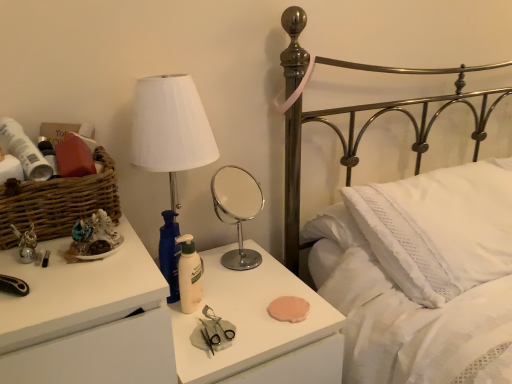
Locate an element on the screen. vacant area located to the right-hand side of white matte lotion at center is located at coordinates (250, 306).